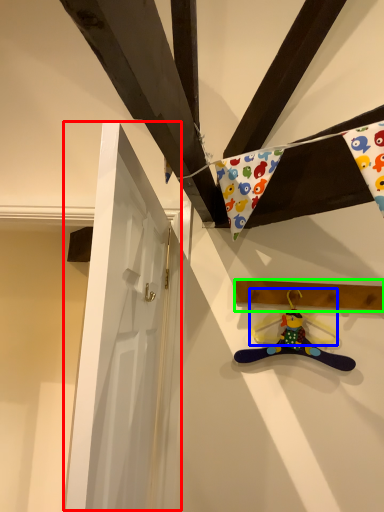
Question: Which object is positioned farthest from door (highlighted by a red box)? Select from hanger (highlighted by a blue box) and plank (highlighted by a green box).

Choices:
 (A) hanger
 (B) plank

Answer: (A)